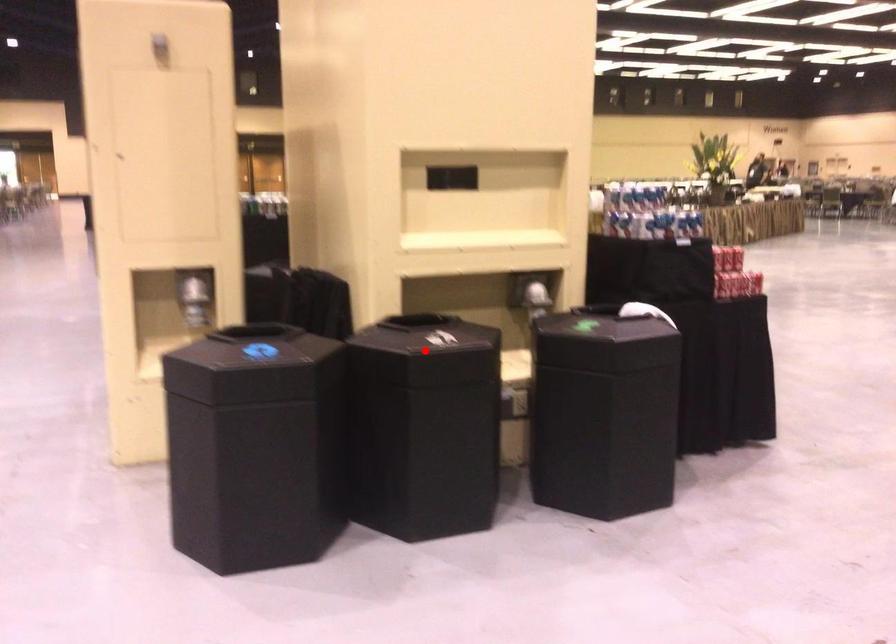
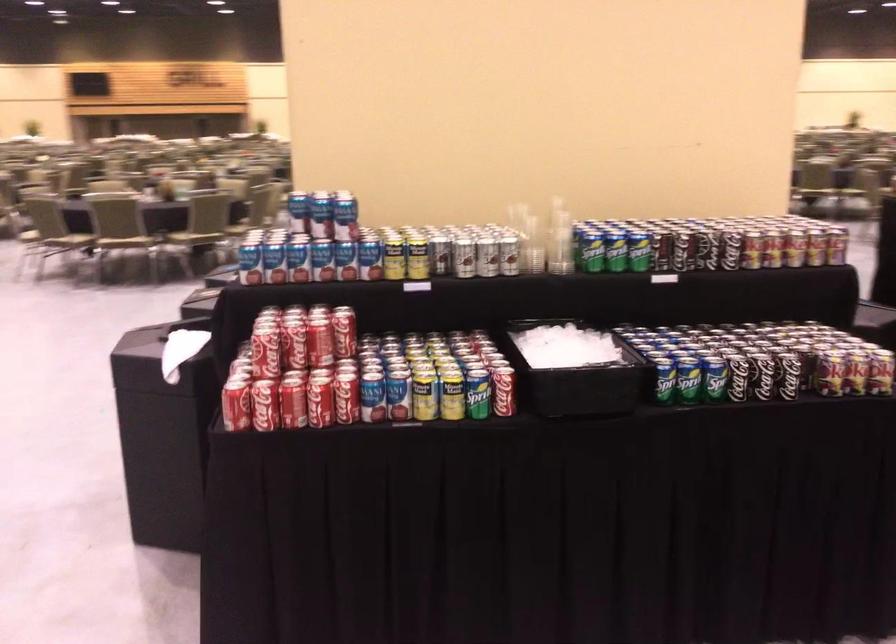
Question: I am providing you with two images of the same scene from different viewpoints. A red point is marked on the first image. At the location where the point appears in image 1, is it still visible in image 2?

Choices:
 (A) Yes
 (B) No

Answer: (B)